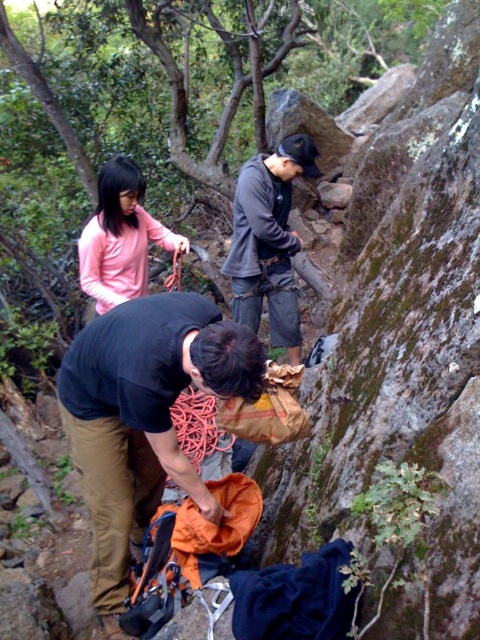
You are a hiker who needs to pack your gear. You have a black fabric backpack at center and a dark gray fabric climbing harness at center. Which item is taller?

The black fabric backpack at center is taller than the dark gray fabric climbing harness at center.

You are a hiker with a 36 inch long backpack strap. You need to pass between the matte pink shirt at upper left and the orange nylon rope at center. Can your backpack fit through the space between them?

The distance between the matte pink shirt at upper left and the orange nylon rope at center is 34.95 inches. Since your backpack strap is 36 inches long, it is slightly longer than the available space. Therefore, the backpack might not fit through the gap comfortably.